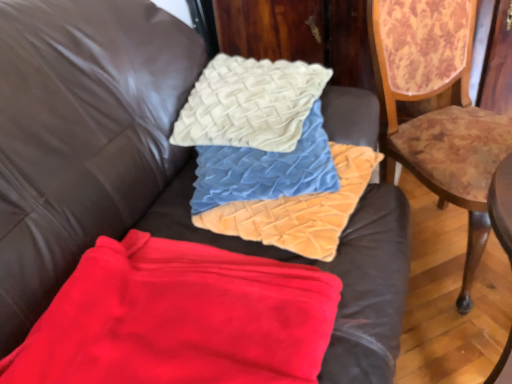
Question: From the image's perspective, relative to velvet textured pillow at center, is creamy velvet cushion at upper center above or below?

Choices:
 (A) above
 (B) below

Answer: (A)

Question: In terms of height, does creamy velvet cushion at upper center look taller or shorter compared to velvet textured pillow at center?

Choices:
 (A) tall
 (B) short

Answer: (B)

Question: Which is nearer to the red fleece blanket at lower left, which appears as the 1th material when ordered from the bottom?

Choices:
 (A) velvet textured pillows at center, the second material positioned from the bottom
 (B) velvet textured pillow at center
 (C) wooden floral-patterned chair at right
 (D) creamy velvet cushion at upper center

Answer: (A)

Question: Which is farther from the creamy velvet cushion at upper center?

Choices:
 (A) wooden floral-patterned chair at right
 (B) red fleece blanket at lower left, which appears as the 1th material when ordered from the bottom
 (C) velvet textured pillows at center, the second material positioned from the bottom
 (D) velvet textured pillow at center

Answer: (B)